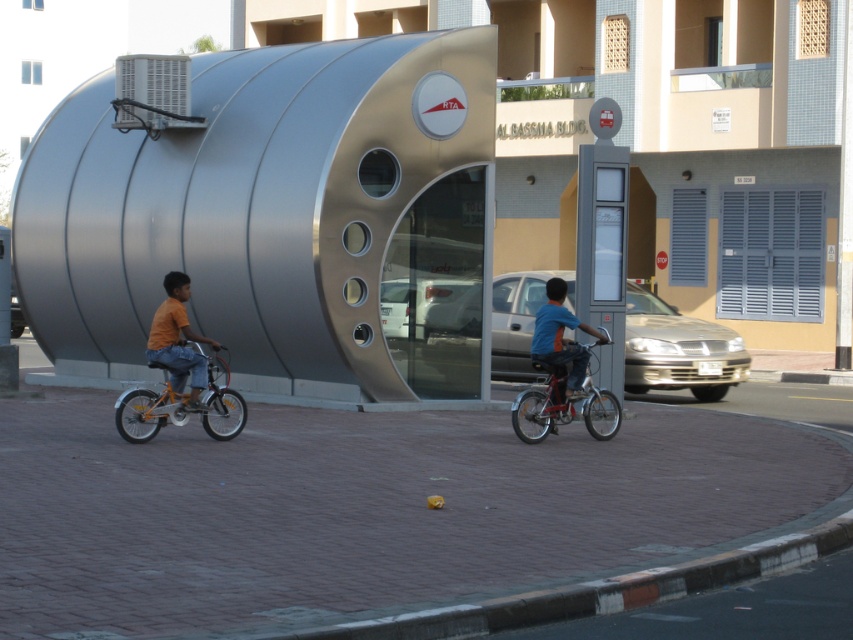
Question: Is metallic red bicycle at center positioned behind orange cotton shirt at left?

Choices:
 (A) no
 (B) yes

Answer: (B)

Question: Can you confirm if orange metallic bicycle at left is bigger than blue fabric shirt at center?

Choices:
 (A) no
 (B) yes

Answer: (B)

Question: Does orange metallic bicycle at left have a smaller size compared to metallic red bicycle at center?

Choices:
 (A) no
 (B) yes

Answer: (A)

Question: Among these points, which one is nearest to the camera?

Choices:
 (A) (618, 422)
 (B) (556, 317)
 (C) (233, 410)
 (D) (193, 372)

Answer: (D)

Question: Which object is positioned closest to the orange metallic bicycle at left?

Choices:
 (A) orange cotton shirt at left
 (B) blue fabric shirt at center
 (C) metallic red bicycle at center

Answer: (A)

Question: Which is farther from the orange metallic bicycle at left?

Choices:
 (A) blue fabric shirt at center
 (B) orange cotton shirt at left

Answer: (A)